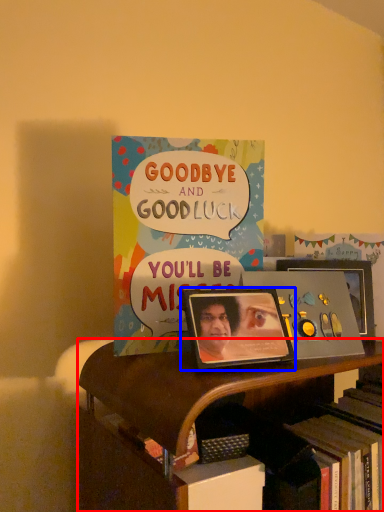
Question: Which object is further to the camera taking this photo, bookcase (highlighted by a red box) or picture frame (highlighted by a blue box)?

Choices:
 (A) bookcase
 (B) picture frame

Answer: (B)